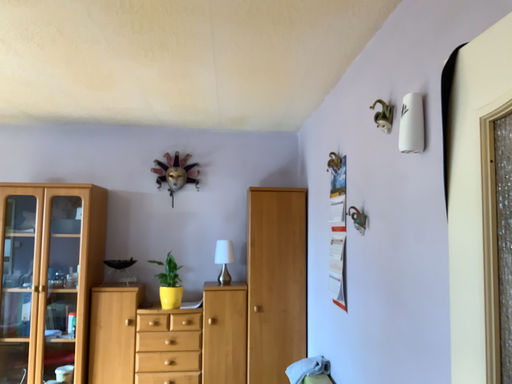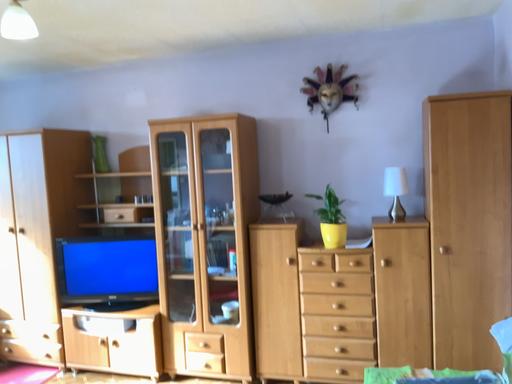
Question: How did the camera likely rotate when shooting the video?

Choices:
 (A) rotated upward
 (B) rotated downward

Answer: (B)